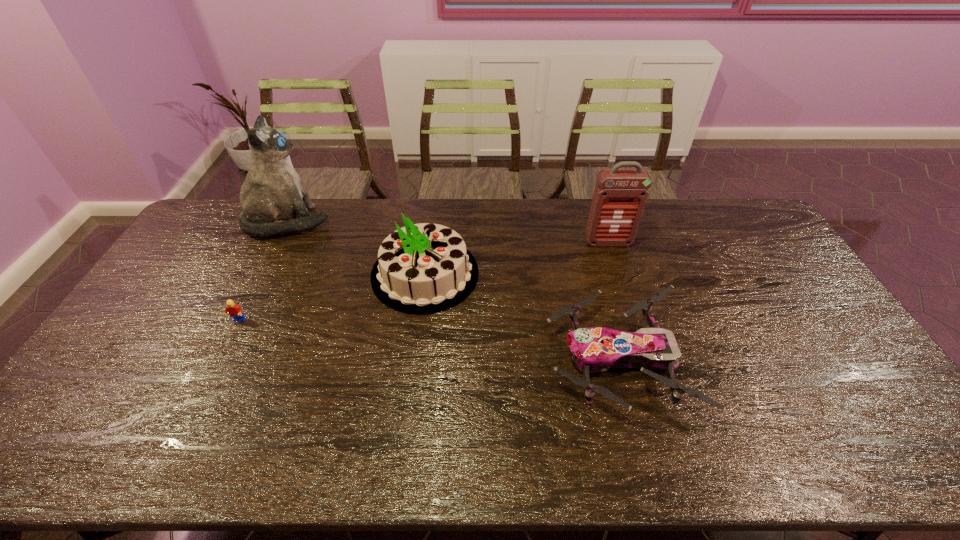
In the image, there is a desktop. At what (x,y) coordinates should I click in order to perform the action: click on vacant space at the right edge. Please return your answer as a coordinate pair (x, y). The image size is (960, 540). Looking at the image, I should click on (773, 260).

Identify the location of vacant space at the far left corner. (237, 201).

In order to click on free space between the first-aid kit and the third tallest object in this screenshot , I will do `click(516, 258)`.

Where is `vacant space that's between the Lego and the third tallest object`? vacant space that's between the Lego and the third tallest object is located at coordinates (331, 298).

Identify the location of free spot between the drone and the third object from right to left. Image resolution: width=960 pixels, height=540 pixels. (521, 317).

At what (x,y) coordinates should I click in order to perform the action: click on empty space between the drone and the Lego. Please return your answer as a coordinate pair (x, y). Image resolution: width=960 pixels, height=540 pixels. Looking at the image, I should click on (427, 340).

The width and height of the screenshot is (960, 540). I want to click on unoccupied position between the Lego and the cat, so click(263, 271).

Image resolution: width=960 pixels, height=540 pixels. What are the coordinates of `free space between the second tallest object and the third object from right to left` in the screenshot? It's located at (516, 258).

I want to click on free area in between the third tallest object and the second tallest object, so click(x=516, y=258).

Locate which object is the second closest to the first-aid kit. Please provide its 2D coordinates. Your answer should be formatted as a tuple, i.e. [(x, y)], where the tuple contains the x and y coordinates of a point satisfying the conditions above.

[(425, 268)]